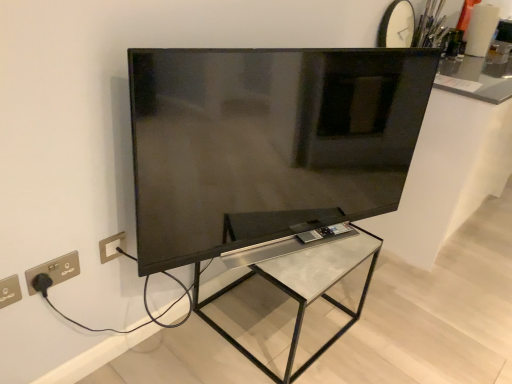
Question: Is silver metallic electric outlet at lower left in front of or behind matte black tv at center in the image?

Choices:
 (A) behind
 (B) front

Answer: (A)

Question: In terms of size, does silver metallic electric outlet at lower left appear bigger or smaller than matte black tv at center?

Choices:
 (A) big
 (B) small

Answer: (B)

Question: Based on their relative distances, which object is nearer to the metallic glass table at center?

Choices:
 (A) white glossy countertop at upper right
 (B) gold metallic socket at lower left
 (C) matte black tv at center
 (D) silver metallic electric outlet at lower left

Answer: (C)

Question: Which is farther from the white glossy countertop at upper right?

Choices:
 (A) gold metallic socket at lower left
 (B) metallic glass table at center
 (C) silver metallic electric outlet at lower left
 (D) matte black tv at center

Answer: (C)